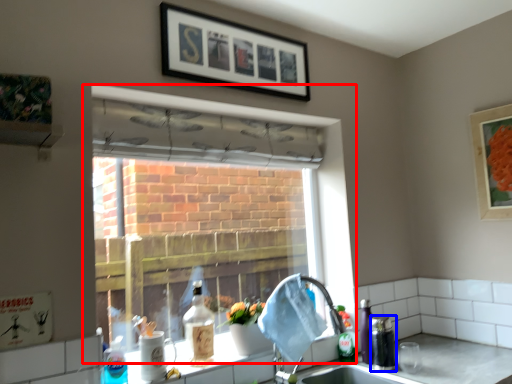
Question: Which object is further to the camera taking this photo, window (highlighted by a red box) or beverage (highlighted by a blue box)?

Choices:
 (A) window
 (B) beverage

Answer: (B)